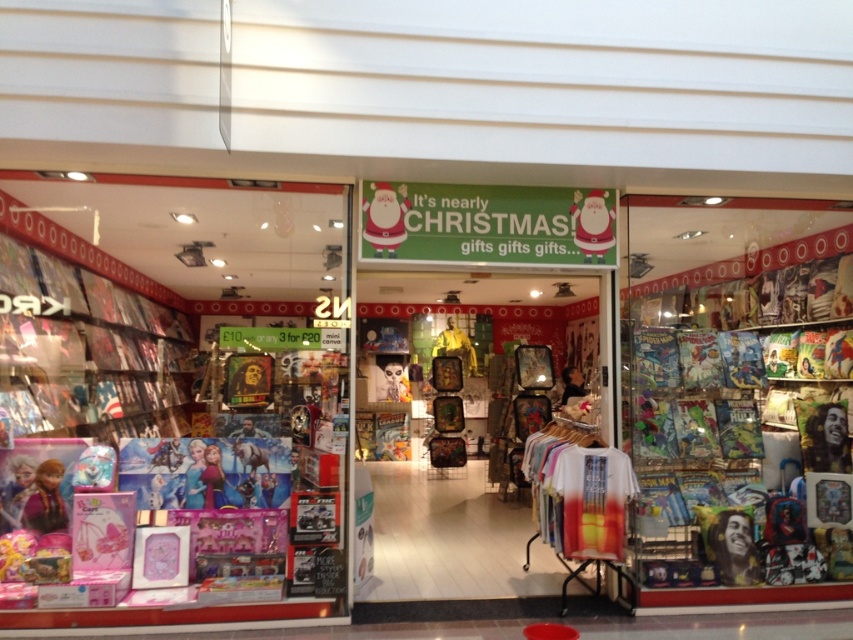
You are a customer who wants to buy a Christmas gift for your friend. You are standing at the entrance of the store. You see the metallic comic books at right and the matte plastic santa at center. Which item is closer to you?

The matte plastic santa at center is closer to you because it is located at the center of the store, while the metallic comic books at right are positioned further away on the right side.

You are a customer standing at the entrance of the store. You see a point marked at coordinates (x=734, y=392). What is located at that point?

The point at coordinates (x=734, y=392) marks metallic comic books at right.